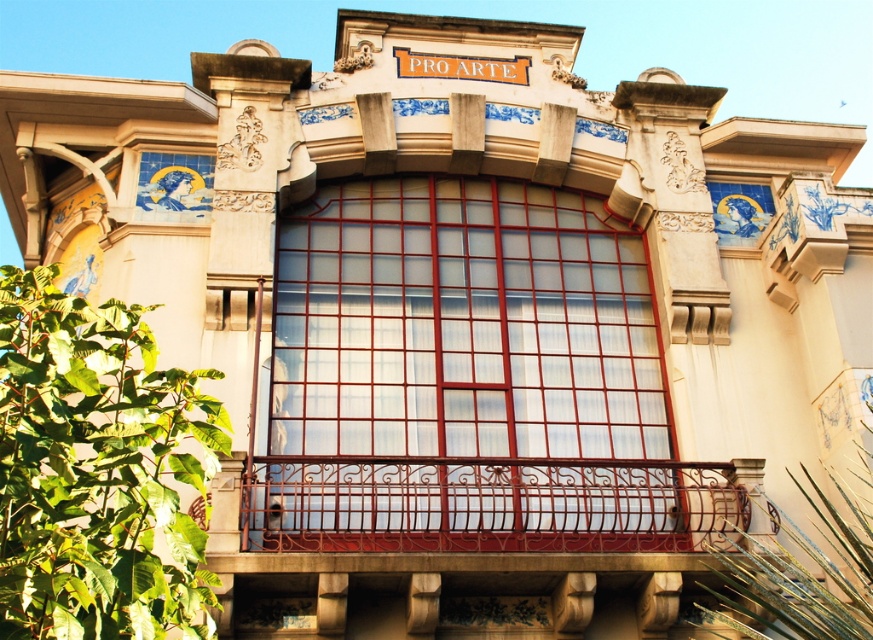
Who is more forward, (377,188) or (633,524)?

Positioned in front is point (633,524).

Does matte glass window at center appear under rusty metal balustrade at center?

Incorrect, matte glass window at center is not positioned below rusty metal balustrade at center.

Does point (449, 328) lie in front of point (597, 490)?

No, (449, 328) is further to viewer.

Image resolution: width=873 pixels, height=640 pixels. I want to click on matte glass window at center, so click(464, 376).